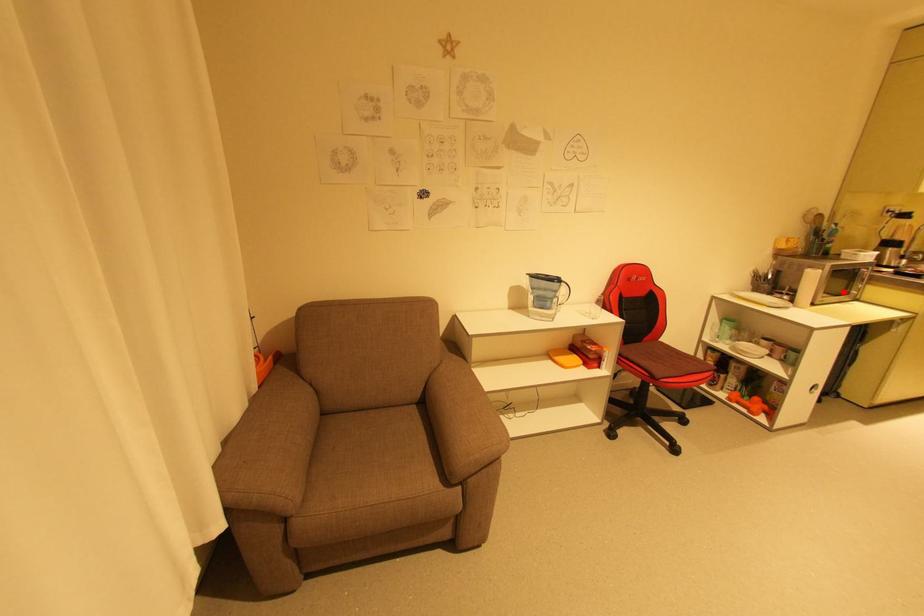
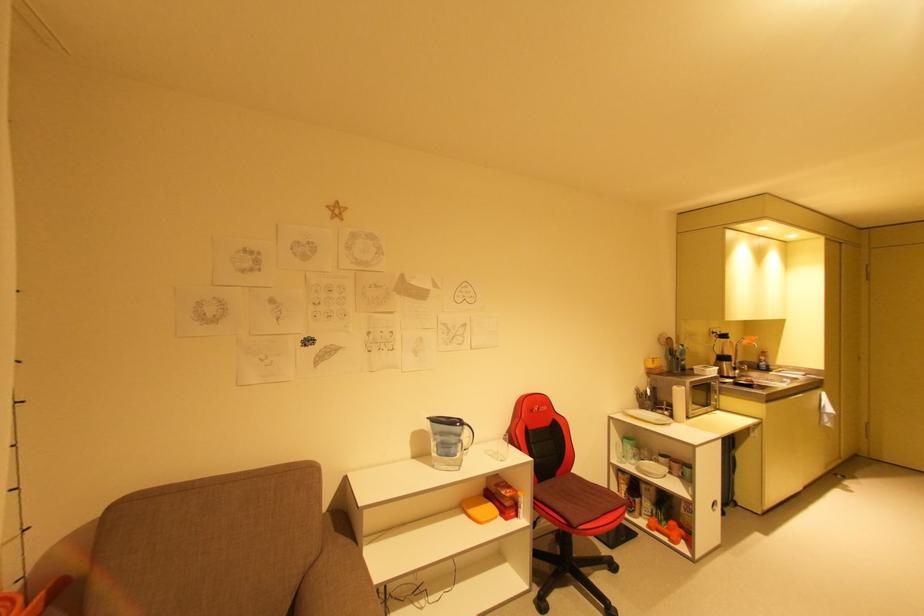
Find the pixel in the second image that matches the highlighted location in the first image.

(708, 403)